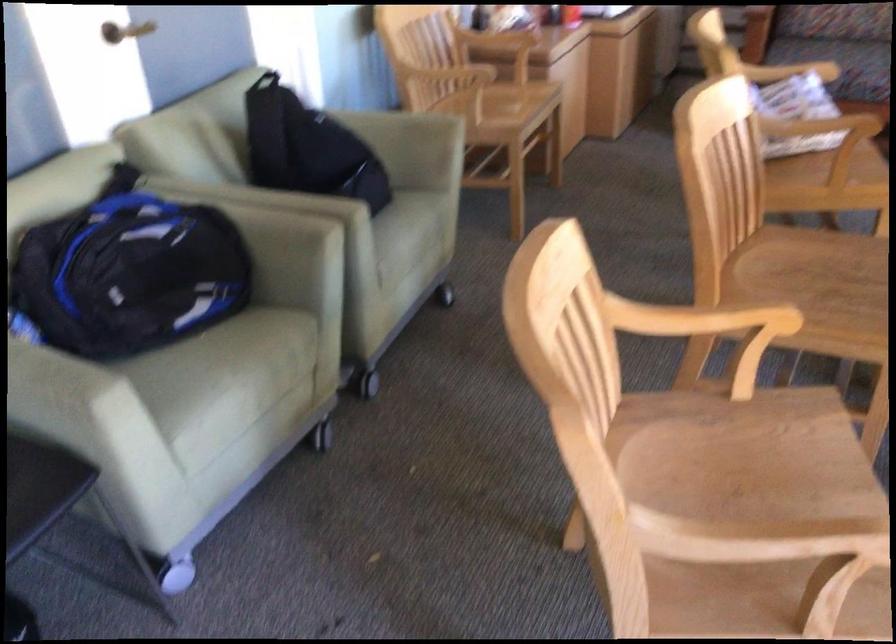
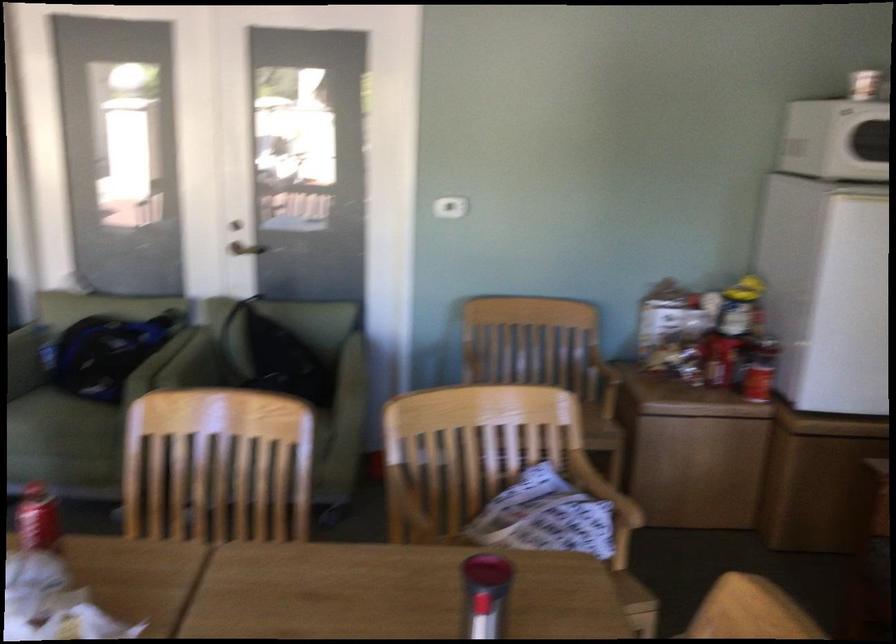
Find the pixel in the second image that matches the point at 117,261 in the first image.

(104, 354)